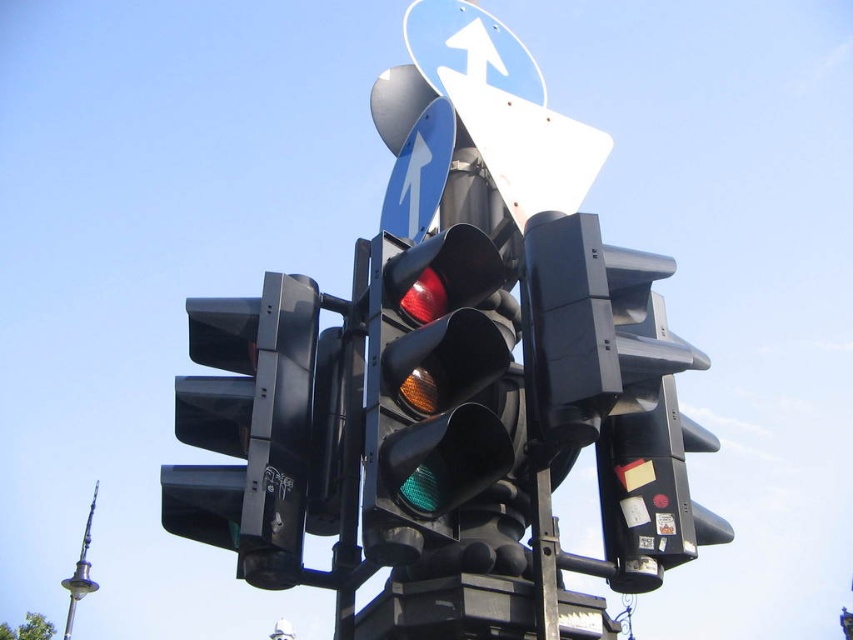
You are a delivery drone flying at an altitude of 20 meters above the ground. You need to land on a platform located at the base of the traffic light pole. However, you must avoid hitting any objects during your descent. Given the distance between the black plastic traffic light at center and the blue glossy sign at upper center, can you safely descend vertically without colliding with either object?

The distance between the black plastic traffic light at center and the blue glossy sign at upper center is 19.77 meters. Since the drone is flying at 20 meters altitude and needs to descend vertically, it can safely land without colliding with either object as the vertical clearance is sufficient.

You are a driver approaching an intersection and notice two road signs above the traffic light. The white plastic traffic sign at upper center and the blue glossy sign at upper center. Which one is bigger?

The white plastic traffic sign at upper center has a larger size compared to the blue glossy sign at upper center, so the white plastic traffic sign at upper center is bigger.

You are driving a car and see the white plastic traffic sign at upper center and the blue glossy sign at upper center. Which sign is closer to you?

The white plastic traffic sign at upper center is closer to you because it is in front of the blue glossy sign at upper center.